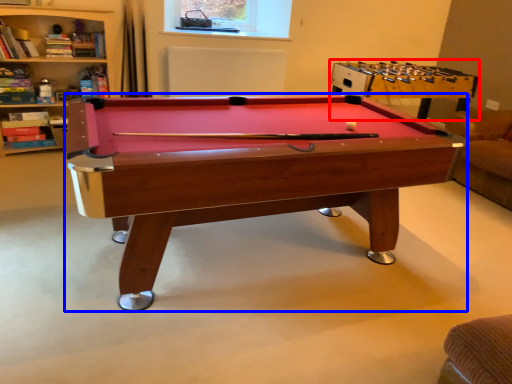
Question: Which object appears closest to the camera in this image, table (highlighted by a red box) or billiard table (highlighted by a blue box)?

Choices:
 (A) table
 (B) billiard table

Answer: (B)